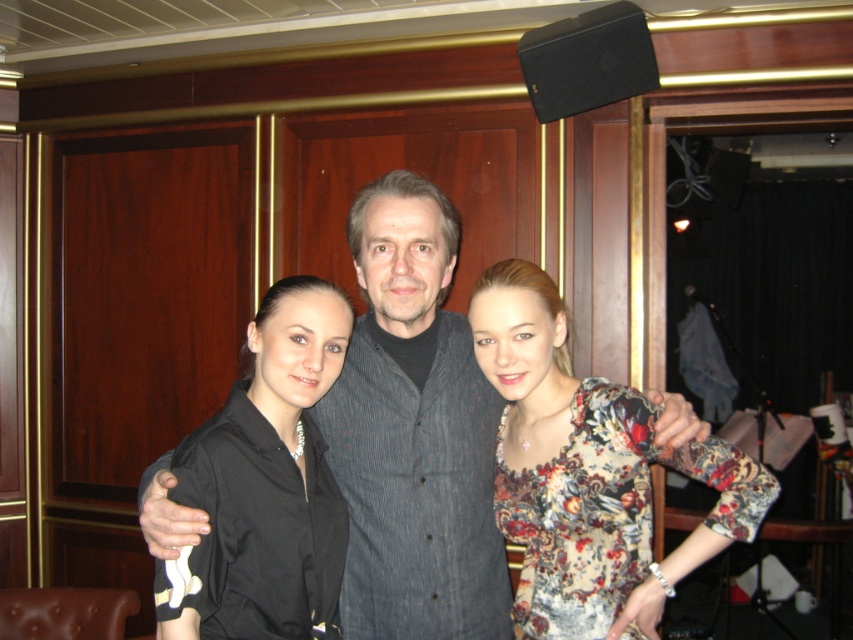
You are a photographer at this event and need to adjust the camera focus between the dark gray textured shirt at center and the black satin blouse at center. The camera can only focus on objects within 20 centimeters of each other. Can you focus on both simultaneously?

The distance between the dark gray textured shirt at center and the black satin blouse at center is 19.13 centimeters, which is within the 20 centimeter range. Therefore, the camera can focus on both simultaneously.